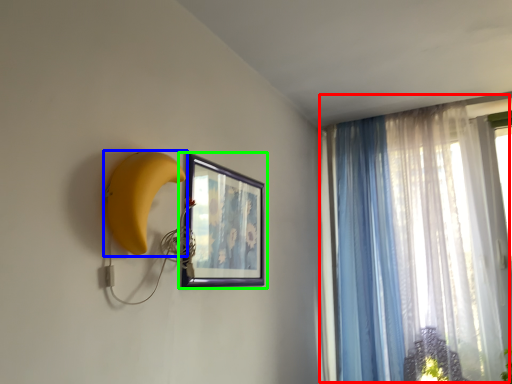
Question: Estimate the real-world distances between objects in this image. Which object is closer to curtain (highlighted by a red box), banana (highlighted by a blue box) or picture frame (highlighted by a green box)?

Choices:
 (A) banana
 (B) picture frame

Answer: (B)